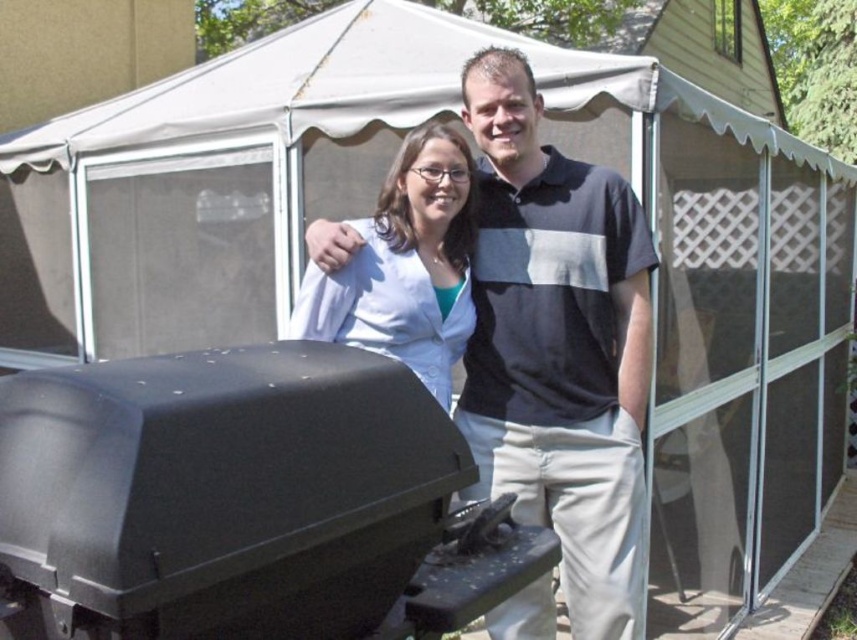
Can you confirm if white fabric canopy at upper center is thinner than white matte shirt at center?

In fact, white fabric canopy at upper center might be wider than white matte shirt at center.

Between point (166, 125) and point (348, 308), which one is positioned behind?

The point (166, 125) is behind.

This screenshot has height=640, width=857. Find the location of `white fabric canopy at upper center`. white fabric canopy at upper center is located at coordinates (345, 109).

Who is more forward, (373, 424) or (307, 310)?

Point (373, 424) is in front.

Can you confirm if black matte barbecue grill at lower left is smaller than white matte shirt at center?

No.

Who is more distant from viewer, (x=220, y=515) or (x=466, y=241)?

The point (x=466, y=241) is more distant.

This screenshot has width=857, height=640. Find the location of `black matte barbecue grill at lower left`. black matte barbecue grill at lower left is located at coordinates (243, 500).

Is point (634, 616) positioned behind point (446, 202)?

Yes, point (634, 616) is behind point (446, 202).

Which is behind, point (525, 449) or point (304, 291)?

Point (525, 449)

What are the coordinates of `dark gray polo shirt at center` in the screenshot? It's located at (559, 346).